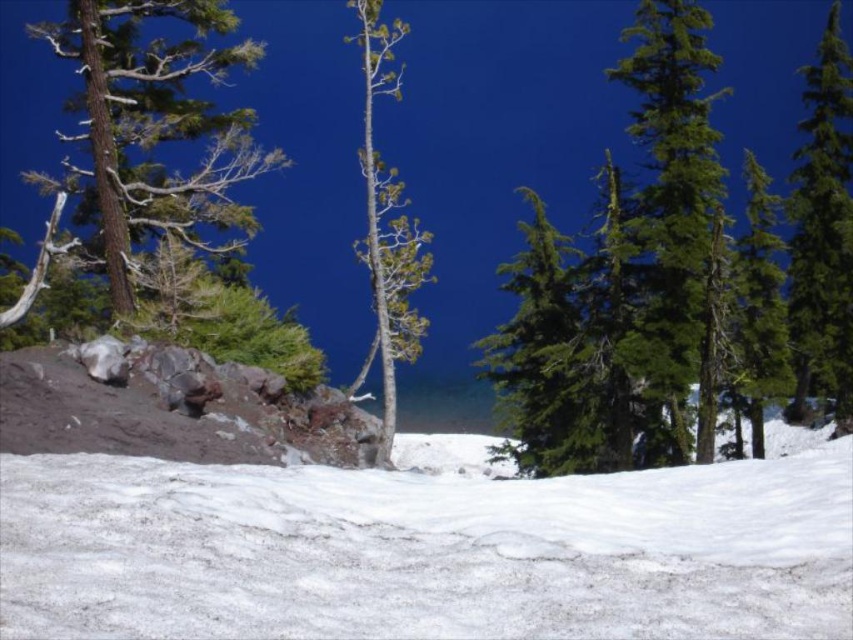
Between brown rough bark tree at left and green textured tree at right, which one appears on the left side from the viewer's perspective?

Positioned to the left is brown rough bark tree at left.

Is brown rough bark tree at left below green textured tree at right?

Correct, brown rough bark tree at left is located below green textured tree at right.

Which is behind, point (229, 161) or point (718, 204)?

Positioned behind is point (229, 161).

The height and width of the screenshot is (640, 853). I want to click on brown rough bark tree at left, so click(x=148, y=131).

Is point (614, 548) more distant than point (711, 58)?

No, it is in front of (711, 58).

Is point (126, 465) farther from camera compared to point (849, 390)?

No.

Identify the location of white snow at center. (424, 548).

Who is lower down, green matte tree at upper right or green textured tree at right?

green matte tree at upper right is below.

Who is more distant from viewer, (500,340) or (676,173)?

Positioned behind is point (500,340).

Where is `green matte tree at upper right`? This screenshot has width=853, height=640. green matte tree at upper right is located at coordinates (625, 282).

Where is `green matte tree at upper right`? green matte tree at upper right is located at coordinates (625, 282).